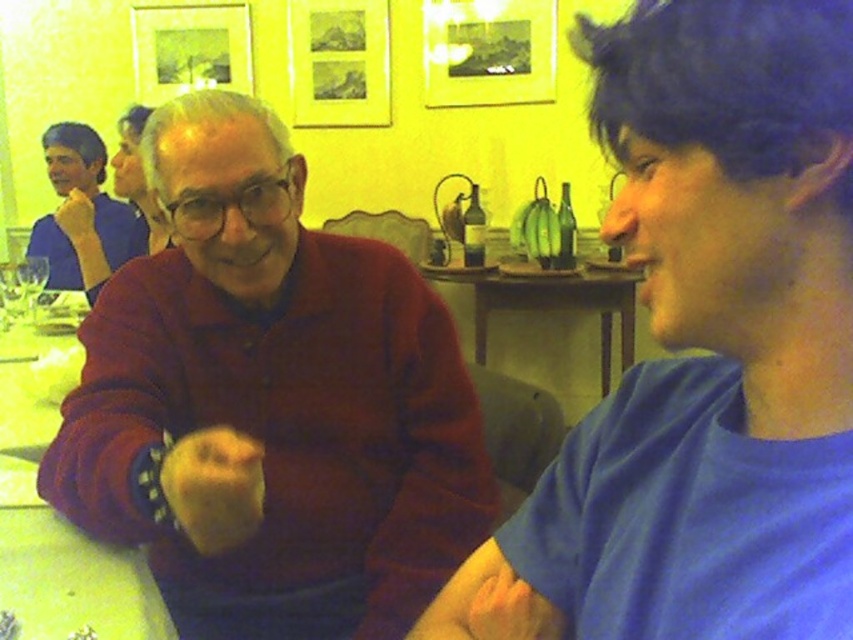
You are planning to place a vase on the wooden table at center. However, there is an object called wooden at center in the scene. Where exactly should you place the vase to avoid it?

The wooden table at center is located below the wooden at center, so placing the vase on the upper part of the wooden table at center would avoid the wooden at center.

You are at a party and want to grab a drink. You see the matte blue shirt at left and the transparent plastic wine glass at lower left. Which object is closer to the left side of the image?

The matte blue shirt at left is closer to the left side of the image than the transparent plastic wine glass at lower left.

You are a photographer setting up a tripod in this scene. You need to place the tripod so that both the wooden table at center and the transparent plastic wine glass at lower left are in focus. Which object should you focus on to ensure both are sharp?

You should focus on the wooden table at center because it is closer to the viewer than the transparent plastic wine glass at lower left, so focusing on the closer object will maximize the depth of field to include both in focus.